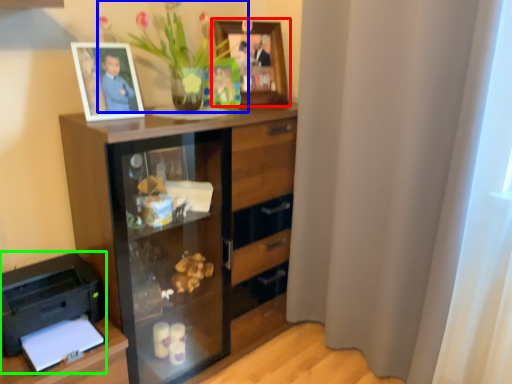
Question: Which is farther away from picture frame (highlighted by a red box)? floral arrangement (highlighted by a blue box) or printer (highlighted by a green box)?

Choices:
 (A) floral arrangement
 (B) printer

Answer: (B)